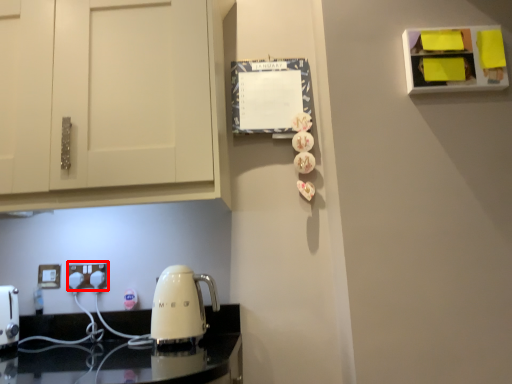
Question: Considering the relative positions of electric outlet (annotated by the red box) and electric outlet in the image provided, where is electric outlet (annotated by the red box) located with respect to the staircase?

Choices:
 (A) right
 (B) left

Answer: (A)